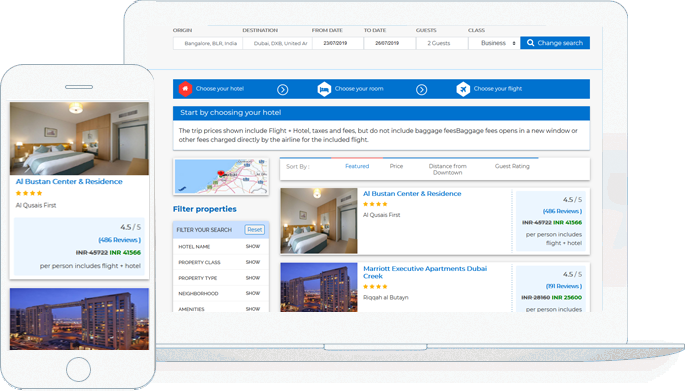
Where is `map`? map is located at coordinates click(x=216, y=182).